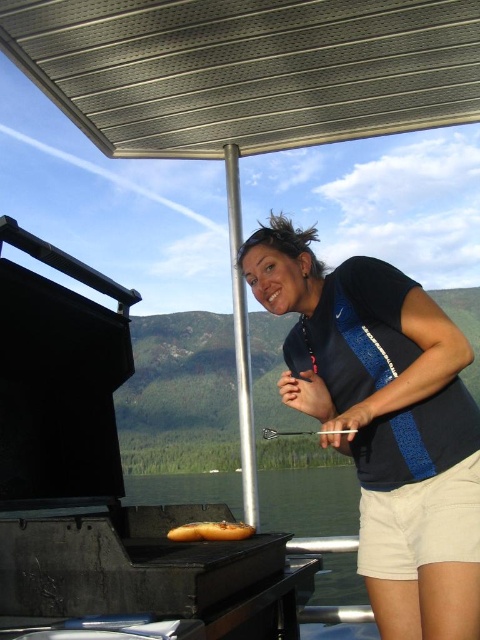
Does black fabric shirt at center lie behind golden brown bread at center?

No.

Measure the distance between black fabric shirt at center and camera.

black fabric shirt at center and camera are 1.22 meters apart.

Locate an element on the screen. This screenshot has width=480, height=640. black fabric shirt at center is located at coordinates (369, 369).

Measure the distance between point (327, 54) and camera.

6.62 feet

Is metallic silver canopy at upper center to the left of black fabric shirt at center from the viewer's perspective?

Correct, you'll find metallic silver canopy at upper center to the left of black fabric shirt at center.

You are a GUI agent. You are given a task and a screenshot of the screen. Output one action in this format:
    pyautogui.click(x=<x>, y=<y>)
    Task: Click on the metallic silver canopy at upper center
    
    Given the screenshot: What is the action you would take?
    tap(247, 68)

Is metallic silver canopy at upper center thinner than golden brown bread at center?

Incorrect, metallic silver canopy at upper center's width is not less than golden brown bread at center's.

Is metallic silver canopy at upper center below golden brown bread at center?

No, metallic silver canopy at upper center is not below golden brown bread at center.

Between point (344, 42) and point (188, 524), which one is positioned in front?

Positioned in front is point (188, 524).

The height and width of the screenshot is (640, 480). What are the coordinates of `metallic silver canopy at upper center` in the screenshot? It's located at pyautogui.click(x=247, y=68).